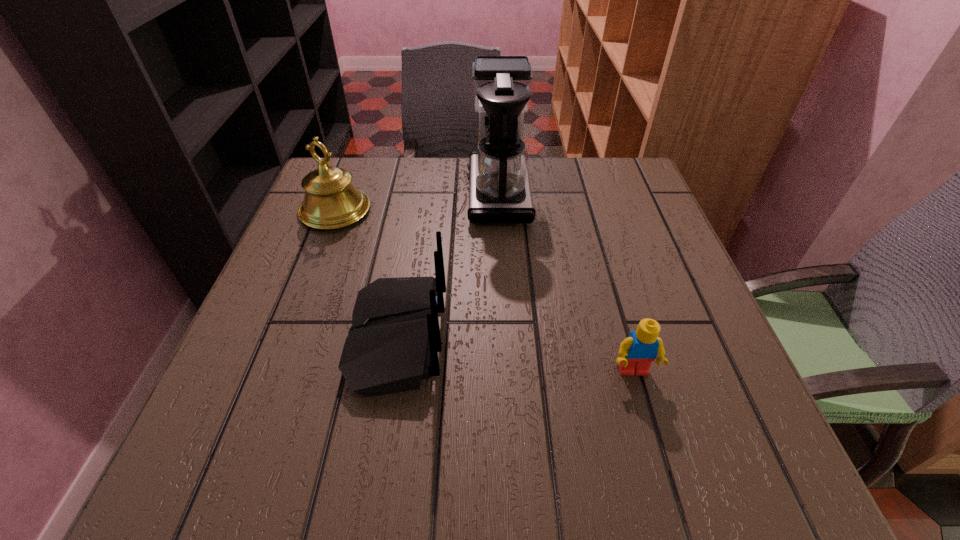
The height and width of the screenshot is (540, 960). I want to click on the second object from right to left, so click(500, 192).

Where is `coffee maker`? coffee maker is located at coordinates (500, 192).

In order to click on the leftmost object in this screenshot , I will do `click(331, 201)`.

This screenshot has height=540, width=960. Identify the location of the second object from left to right. (393, 344).

You are a GUI agent. You are given a task and a screenshot of the screen. Output one action in this format:
    pyautogui.click(x=<x>, y=<y>)
    Task: Click on the shortest object
    The height and width of the screenshot is (540, 960).
    Given the screenshot: What is the action you would take?
    pyautogui.click(x=637, y=352)

Locate an element on the screen. The height and width of the screenshot is (540, 960). the rightmost object is located at coordinates (637, 352).

I want to click on vacant region located 0.140m at the front of the coffee maker where the controls are located, so click(x=410, y=193).

What are the coordinates of `free location located 0.050m at the front of the coffee maker where the controls are located` in the screenshot? It's located at (446, 193).

Identify the location of free region located 0.350m at the front of the coffee maker where the controls are located. (324, 193).

Identify the location of vacant area located 0.400m on the front of the bell. (265, 393).